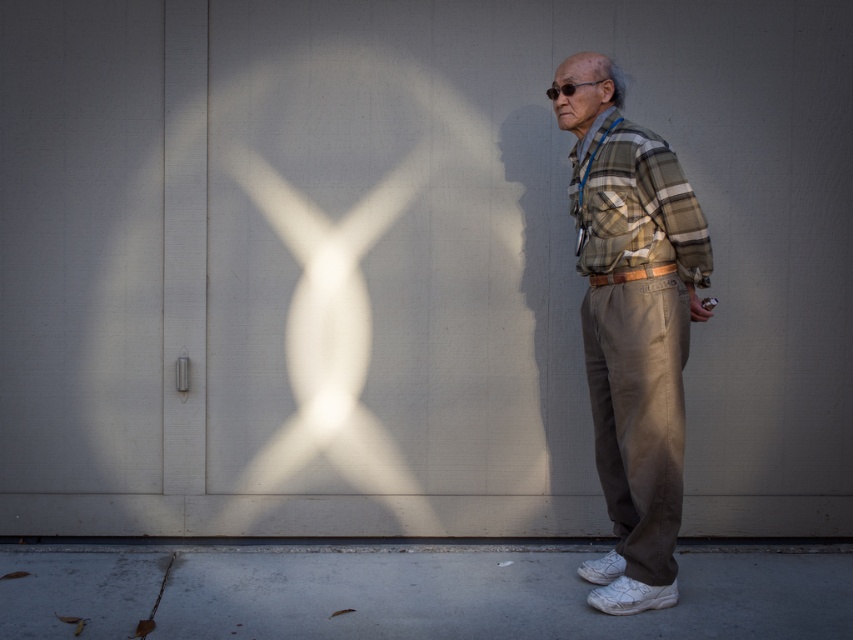
Question: Can you confirm if plaid fabric shirt at center is bigger than matte brown wallet at lower right?

Choices:
 (A) no
 (B) yes

Answer: (B)

Question: Is plaid fabric shirt at center further to camera compared to matte brown wallet at lower right?

Choices:
 (A) yes
 (B) no

Answer: (B)

Question: Does plaid fabric shirt at center have a greater width compared to matte brown wallet at lower right?

Choices:
 (A) yes
 (B) no

Answer: (A)